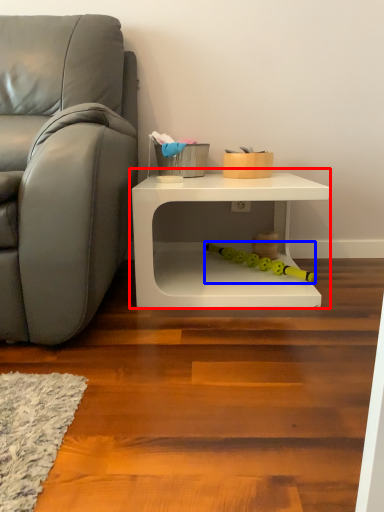
Question: Which of the following is the farthest to the observer, table (highlighted by a red box) or toy (highlighted by a blue box)?

Choices:
 (A) table
 (B) toy

Answer: (B)